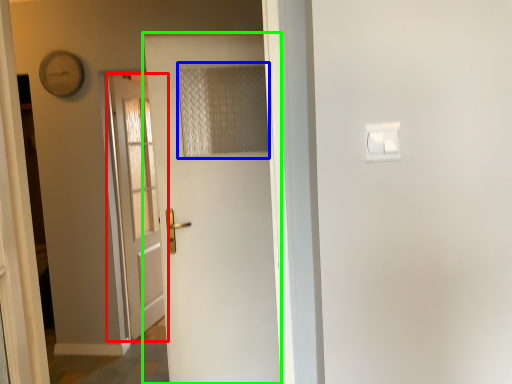
Question: Estimate the real-world distances between objects in this image. Which object is farther from door (highlighted by a red box), curtain (highlighted by a blue box) or door (highlighted by a green box)?

Choices:
 (A) curtain
 (B) door

Answer: (A)